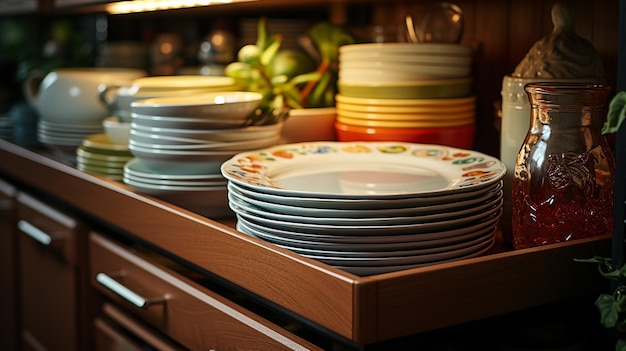
The height and width of the screenshot is (351, 626). I want to click on 4 plates on bottom of dish stack on frontmost dishes, so click(x=354, y=271), click(x=379, y=262), click(x=359, y=255), click(x=392, y=247).